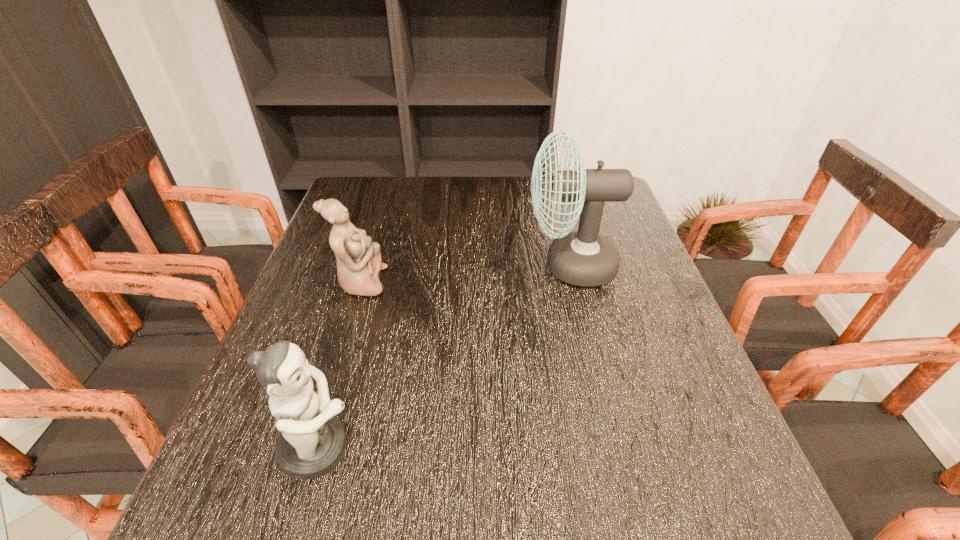
This screenshot has width=960, height=540. What are the coordinates of `empty location between the nearest object and the fan` in the screenshot? It's located at (445, 357).

Identify the location of free point between the nearer figurine and the farther figurine. (340, 365).

At what (x,y) coordinates should I click in order to perform the action: click on unoccupied area between the fan and the farther figurine. Please return your answer as a coordinate pair (x, y). Looking at the image, I should click on (466, 274).

Where is `vacant point located between the farther figurine and the rightmost object`? vacant point located between the farther figurine and the rightmost object is located at coordinates [466, 274].

Identify the location of unoccupied area between the farther figurine and the rightmost object. (466, 274).

You are a GUI agent. You are given a task and a screenshot of the screen. Output one action in this format:
    pyautogui.click(x=<x>, y=<y>)
    Task: Click on the vacant region between the nearer figurine and the fan
    The width and height of the screenshot is (960, 540).
    Given the screenshot: What is the action you would take?
    pyautogui.click(x=445, y=357)

Image resolution: width=960 pixels, height=540 pixels. Find the location of `vacant point located between the rightmost object and the nearer figurine`. vacant point located between the rightmost object and the nearer figurine is located at coordinates (445, 357).

Identify which object is the second nearest to the nearest object. Please provide its 2D coordinates. Your answer should be formatted as a tuple, i.e. [(x, y)], where the tuple contains the x and y coordinates of a point satisfying the conditions above.

[(584, 258)]

The image size is (960, 540). Identify the location of object that is the second closest to the farther figurine. (584, 258).